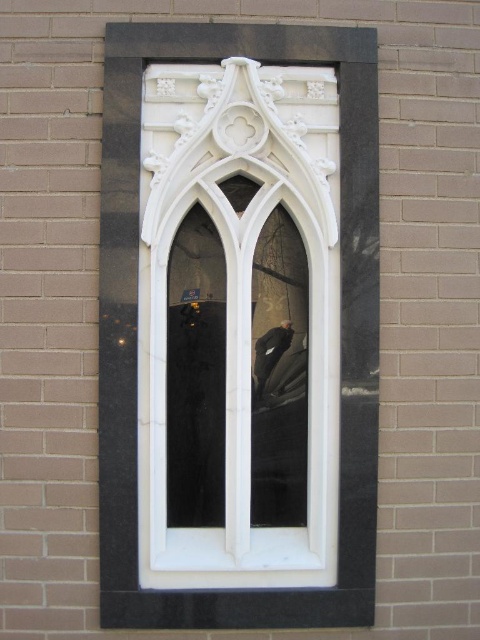
You are standing in front of a brick wall with a Gothic window. There is a specific point marked at coordinates point (136, 316). What object is located exactly at that point?

The white marble window frame at center is located exactly at point (136, 316).

You are standing in front of a brick wall with a decorative window and a leather jacket. According to the image, which object is positioned to the left when you look at the white marble window frame at center and the dark brown leather jacket at center?

The white marble window frame at center is to the left of the dark brown leather jacket at center.

You are an architect reviewing a blueprint and notice the white marble window frame at center. Based on the coordinates provided, can you determine its position relative to the brick wall?

The white marble window frame at center is located at point coordinates (136, 316), which places it centrally positioned on the brick wall.